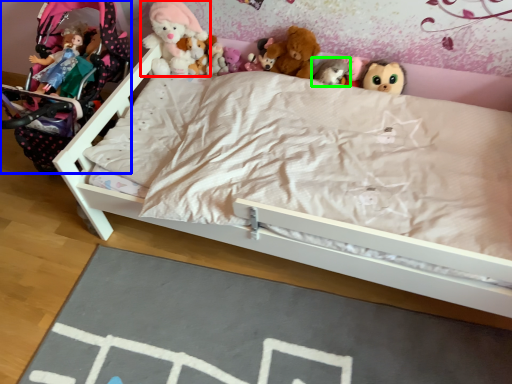
Question: Estimate the real-world distances between objects in this image. Which object is farther from toy (highlighted by a red box), baby carriage (highlighted by a blue box) or toy (highlighted by a green box)?

Choices:
 (A) baby carriage
 (B) toy

Answer: (B)